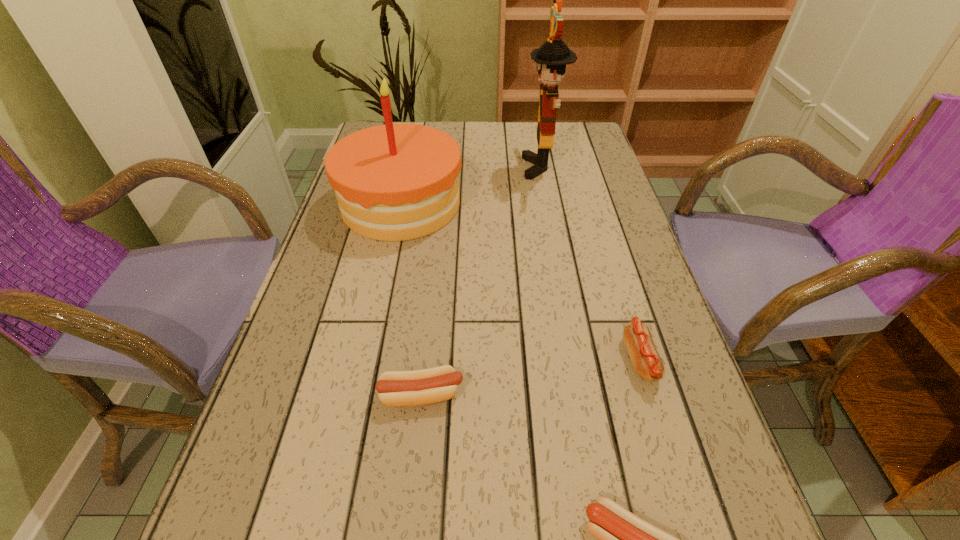
Identify which object is the fourth closest to the nutcracker. Please provide its 2D coordinates. Your answer should be formatted as a tuple, i.e. [(x, y)], where the tuple contains the x and y coordinates of a point satisfying the conditions above.

[(624, 539)]

Select which object appears as the second closest to the shortest sausage. Please provide its 2D coordinates. Your answer should be formatted as a tuple, i.e. [(x, y)], where the tuple contains the x and y coordinates of a point satisfying the conditions above.

[(427, 386)]

The height and width of the screenshot is (540, 960). Identify the location of sausage that is the closest to the leftmost sausage. (624, 539).

Image resolution: width=960 pixels, height=540 pixels. Find the location of `sausage that is the third closest to the fourth shortest object`. sausage that is the third closest to the fourth shortest object is located at coordinates 624,539.

Locate an element on the screen. The image size is (960, 540). free space that satisfies the following two spatial constraints: 1. on the front-facing side of the nutcracker; 2. on the front side of the birthday cake is located at coordinates (548, 204).